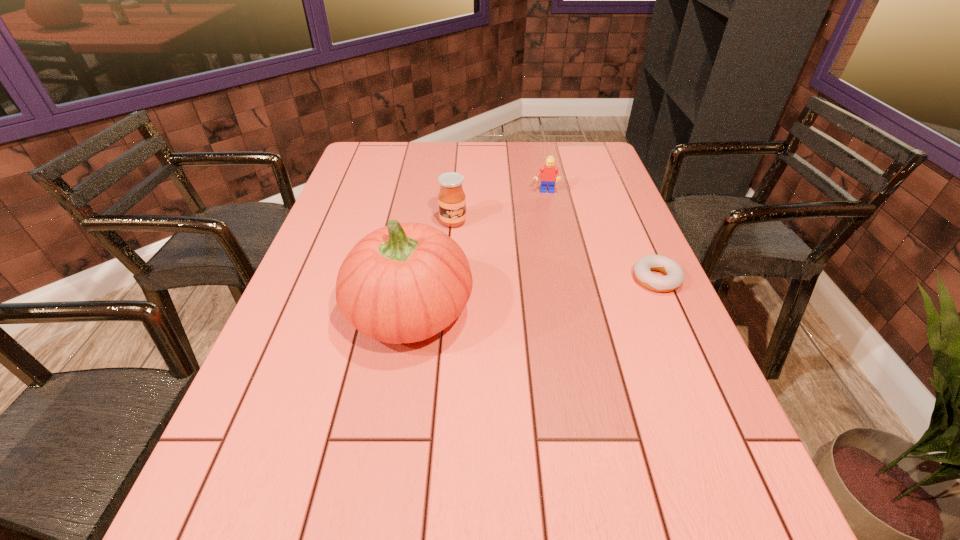
This screenshot has height=540, width=960. In order to click on free space at the far right corner of the desktop in this screenshot , I will do `click(564, 147)`.

The width and height of the screenshot is (960, 540). Find the location of `free point between the doughnut and the second shortest object`. free point between the doughnut and the second shortest object is located at coordinates (601, 236).

Where is `free area in between the Lego and the second tallest object`? free area in between the Lego and the second tallest object is located at coordinates (499, 207).

Locate an element on the screen. This screenshot has height=540, width=960. unoccupied area between the doughnut and the honey is located at coordinates (555, 251).

Where is `free space between the shortest object and the second shortest object`? The image size is (960, 540). free space between the shortest object and the second shortest object is located at coordinates (601, 236).

Image resolution: width=960 pixels, height=540 pixels. What are the coordinates of `empty space between the shortest object and the second tallest object` in the screenshot? It's located at (555, 251).

Find the location of `vacant point located between the second tallest object and the rightmost object`. vacant point located between the second tallest object and the rightmost object is located at coordinates (555, 251).

Identify the location of object that is the closest to the doughnut. (549, 173).

Choose which object is the nearest neighbor to the shortest object. Please provide its 2D coordinates. Your answer should be formatted as a tuple, i.e. [(x, y)], where the tuple contains the x and y coordinates of a point satisfying the conditions above.

[(549, 173)]

Locate an element on the screen. free space that satisfies the following two spatial constraints: 1. on the front side of the third nearest object; 2. on the left side of the rightmost object is located at coordinates (448, 279).